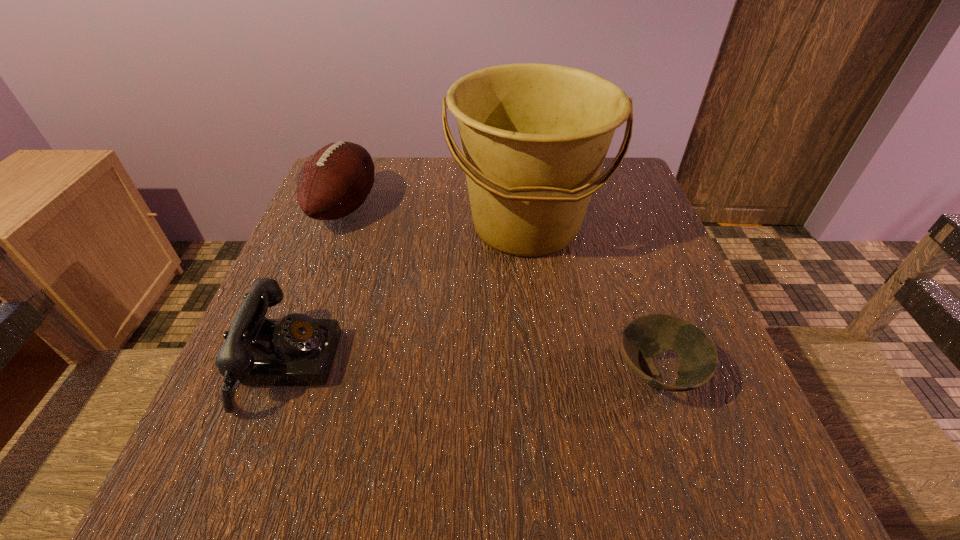
Identify the location of unoccupied position between the tallest object and the bowl. This screenshot has width=960, height=540. (591, 300).

You are a GUI agent. You are given a task and a screenshot of the screen. Output one action in this format:
    pyautogui.click(x=<x>, y=<y>)
    Task: Click on the object that is the third closest to the football (American)
    This screenshot has width=960, height=540.
    Given the screenshot: What is the action you would take?
    pyautogui.click(x=643, y=338)

Find the location of `object that is the second closest to the telephone`. object that is the second closest to the telephone is located at coordinates (335, 181).

I want to click on free space that satisfies the following two spatial constraints: 1. on the side of the bowl with the handle; 2. on the left side of the bucket, so pyautogui.click(x=544, y=374).

Where is `free spot that satisfies the following two spatial constraints: 1. on the side of the shortest object with the handle; 2. on the left side of the bucket`? This screenshot has width=960, height=540. free spot that satisfies the following two spatial constraints: 1. on the side of the shortest object with the handle; 2. on the left side of the bucket is located at coordinates (544, 374).

The width and height of the screenshot is (960, 540). I want to click on vacant point that satisfies the following two spatial constraints: 1. on the side of the bowl with the handle; 2. on the right side of the bucket, so click(x=544, y=374).

You are a GUI agent. You are given a task and a screenshot of the screen. Output one action in this format:
    pyautogui.click(x=<x>, y=<y>)
    Task: Click on the free location that satisfies the following two spatial constraints: 1. on the side of the tallest object with the handle; 2. on the right side of the bowl
    
    Given the screenshot: What is the action you would take?
    pyautogui.click(x=544, y=374)

Image resolution: width=960 pixels, height=540 pixels. Find the location of `vacant space that satisfies the following two spatial constraints: 1. on the side of the tallest object with the handle; 2. on the right side of the bowl`. vacant space that satisfies the following two spatial constraints: 1. on the side of the tallest object with the handle; 2. on the right side of the bowl is located at coordinates [x=544, y=374].

You are a GUI agent. You are given a task and a screenshot of the screen. Output one action in this format:
    pyautogui.click(x=<x>, y=<y>)
    Task: Click on the vacant position in the image that satisfies the following two spatial constraints: 1. on the side of the tallest object with the handle; 2. on the dial of the third tallest object
    
    Given the screenshot: What is the action you would take?
    pyautogui.click(x=543, y=364)

Find the location of a particular element. The height and width of the screenshot is (540, 960). free spot that satisfies the following two spatial constraints: 1. on the dial of the bowl; 2. on the left side of the telephone is located at coordinates (282, 374).